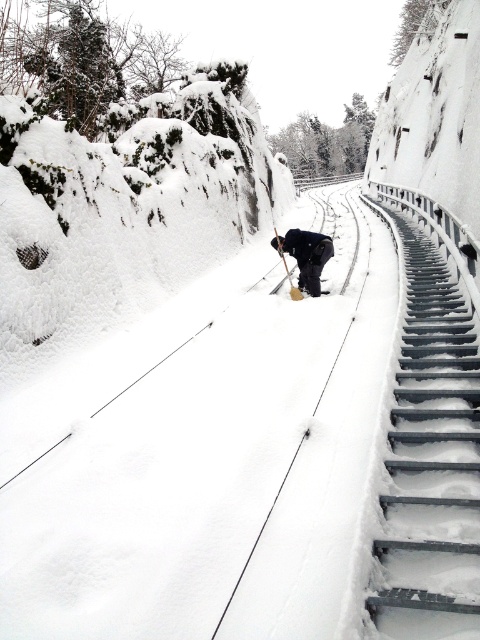
Does dark gray fabric at center appear over wooden ski pole at center?

No.

Is dark gray fabric at center positioned at the back of wooden ski pole at center?

No, it is in front of wooden ski pole at center.

The image size is (480, 640). What are the coordinates of `dark gray fabric at center` in the screenshot? It's located at (305, 256).

Is metallic gray stairs at right shorter than dark gray fabric at center?

In fact, metallic gray stairs at right may be taller than dark gray fabric at center.

Who is lower down, metallic gray stairs at right or dark gray fabric at center?

metallic gray stairs at right

The height and width of the screenshot is (640, 480). In order to click on metallic gray stairs at right in this screenshot , I will do `click(432, 460)`.

Does metallic gray stairs at right have a larger size compared to wooden ski pole at center?

Yes, metallic gray stairs at right is bigger than wooden ski pole at center.

Who is higher up, metallic gray stairs at right or wooden ski pole at center?

wooden ski pole at center is above.

Is point (396, 410) farther from camera compared to point (276, 248)?

No, it is not.

What are the coordinates of `metallic gray stairs at right` in the screenshot? It's located at (432, 460).